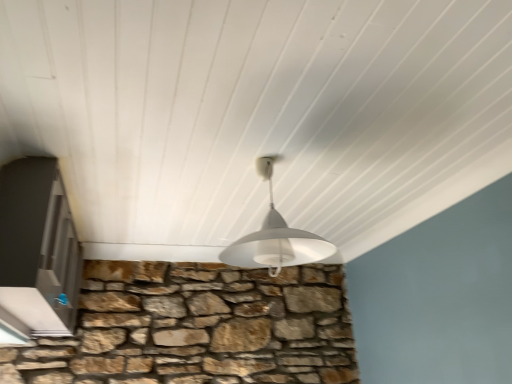
What do you see at coordinates (38, 247) in the screenshot? I see `white glossy door at left` at bounding box center [38, 247].

Identify the location of white glossy door at left. The height and width of the screenshot is (384, 512). (38, 247).

Image resolution: width=512 pixels, height=384 pixels. I want to click on white matte lampshade at center, so click(x=275, y=238).

What do you see at coordinates (275, 238) in the screenshot? The height and width of the screenshot is (384, 512). I see `white matte lampshade at center` at bounding box center [275, 238].

At what (x,y) coordinates should I click in order to perform the action: click on white glossy door at left. Please return your answer as a coordinate pair (x, y). Looking at the image, I should click on (38, 247).

Considering the positions of objects white glossy door at left and white matte lampshade at center in the image provided, who is more to the right, white glossy door at left or white matte lampshade at center?

white matte lampshade at center.

Between white glossy door at left and white matte lampshade at center, which one is positioned behind?

white glossy door at left is behind.

Does point (7, 307) come closer to viewer compared to point (279, 220)?

Yes, point (7, 307) is closer to viewer.

From the image's perspective, between white glossy door at left and white matte lampshade at center, which one is located above?

white matte lampshade at center.

From a real-world perspective, which object stands above the other?

white matte lampshade at center is physically above.

Considering the sizes of objects white glossy door at left and white matte lampshade at center in the image provided, who is wider, white glossy door at left or white matte lampshade at center?

white matte lampshade at center is wider.

Who is shorter, white glossy door at left or white matte lampshade at center?

With less height is white matte lampshade at center.

Does white glossy door at left have a larger size compared to white matte lampshade at center?

Yes.

Looking at this image, is white glossy door at left spatially inside white matte lampshade at center, or outside of it?

white glossy door at left is outside white matte lampshade at center.

Is white glossy door at left next to white matte lampshade at center?

white glossy door at left and white matte lampshade at center are clearly separated.

Is white glossy door at left positioned with its back to white matte lampshade at center?

No, white matte lampshade at center is not at the back of white glossy door at left.

How much distance is there between white glossy door at left and white matte lampshade at center?

A distance of 31.69 inches exists between white glossy door at left and white matte lampshade at center.

The height and width of the screenshot is (384, 512). What are the coordinates of `window located behind the white matte lampshade at center` in the screenshot? It's located at (38, 247).

Considering the relative positions of white matte lampshade at center and white glossy door at left in the image provided, is white matte lampshade at center to the right of white glossy door at left from the viewer's perspective?

Yes, white matte lampshade at center is to the right of white glossy door at left.

Which is in front, white matte lampshade at center or white glossy door at left?

Positioned in front is white matte lampshade at center.

Is point (250, 258) closer or farther from the camera than point (63, 199)?

Point (250, 258).

From the image's perspective, relative to white glossy door at left, is white matte lampshade at center above or below?

→ white matte lampshade at center is above white glossy door at left.

From the picture: From a real-world perspective, is white matte lampshade at center above or below white glossy door at left?

From a real-world perspective, white matte lampshade at center is physically above white glossy door at left.

Considering the relative sizes of white matte lampshade at center and white glossy door at left in the image provided, is white matte lampshade at center wider than white glossy door at left?

Yes, white matte lampshade at center is wider than white glossy door at left.

In terms of height, does white matte lampshade at center look taller or shorter compared to white glossy door at left?

white matte lampshade at center is shorter than white glossy door at left.

Looking at the image, does white matte lampshade at center seem bigger or smaller compared to white glossy door at left?

Considering their sizes, white matte lampshade at center takes up less space than white glossy door at left.

Which is correct: white matte lampshade at center is inside white glossy door at left, or outside of it?

white matte lampshade at center is not enclosed by white glossy door at left.

Does white matte lampshade at center touch white glossy door at left?

No, white matte lampshade at center is not next to white glossy door at left.

Is white matte lampshade at center positioned with its back to white glossy door at left?

No, white matte lampshade at center is not facing the opposite direction of white glossy door at left.

Consider the image. How different are the orientations of white matte lampshade at center and white glossy door at left in degrees?

The facing directions of white matte lampshade at center and white glossy door at left are 88 degrees apart.

Find the location of `window located below the white matte lampshade at center (from the image's perspective)`. window located below the white matte lampshade at center (from the image's perspective) is located at coordinates (38, 247).

Where is `lamp lying in front of the white glossy door at left`? lamp lying in front of the white glossy door at left is located at coordinates (275, 238).

At what (x,y) coordinates should I click in order to perform the action: click on window on the left of white matte lampshade at center. Please return your answer as a coordinate pair (x, y). Looking at the image, I should click on (38, 247).